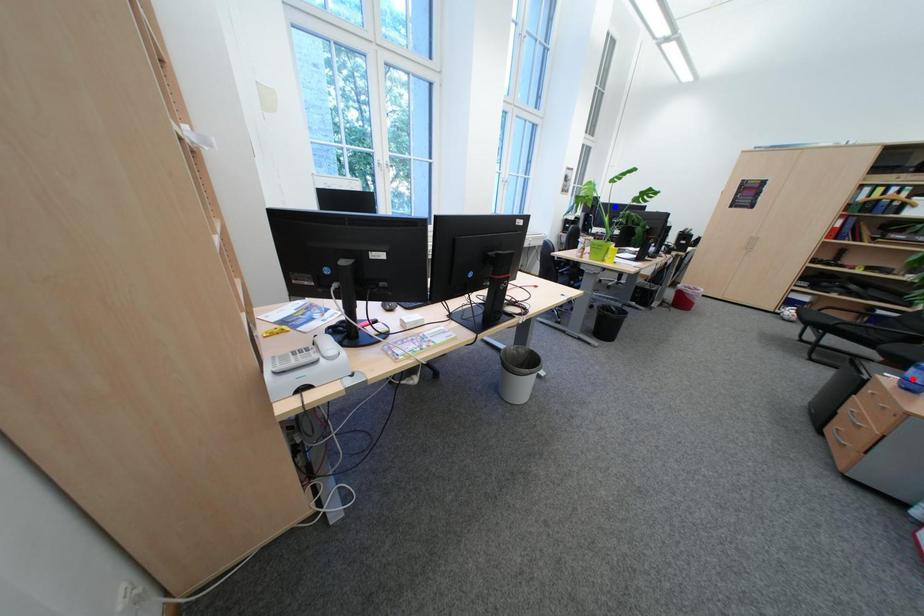
Question: In the image, two points are highlighted. Which point is nearer to the camera? Reply with the corresponding letter.

Choices:
 (A) blue point
 (B) red point

Answer: (B)